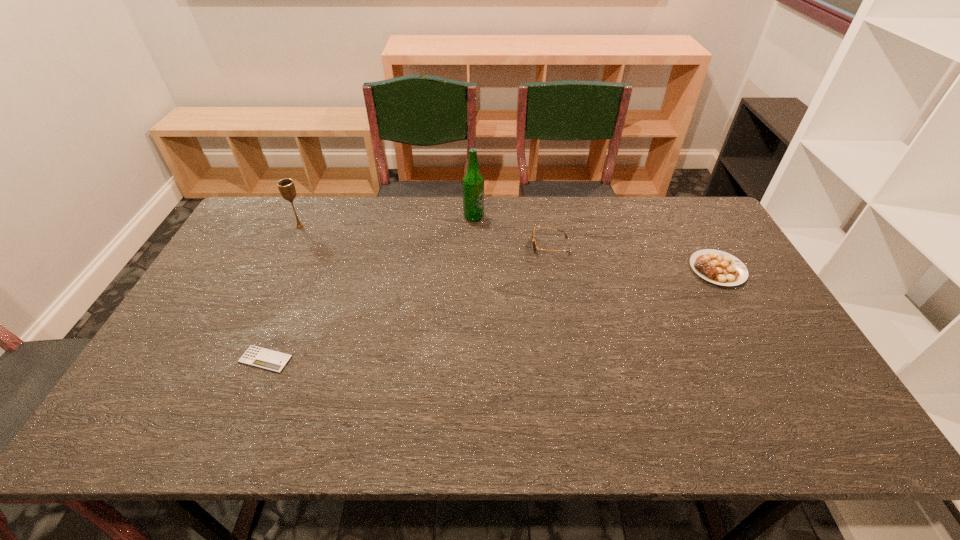
The width and height of the screenshot is (960, 540). Find the location of `blank area located 0.260m on the front of the chalice`. blank area located 0.260m on the front of the chalice is located at coordinates (272, 286).

Where is `free region located 0.100m on the front-facing side of the sunglasses`? free region located 0.100m on the front-facing side of the sunglasses is located at coordinates (501, 246).

You are a GUI agent. You are given a task and a screenshot of the screen. Output one action in this format:
    pyautogui.click(x=<x>, y=<y>)
    Task: Click on the vacant space located 0.190m on the front-facing side of the sunglasses
    The image size is (960, 540).
    Given the screenshot: What is the action you would take?
    pyautogui.click(x=472, y=246)

You are a GUI agent. You are given a task and a screenshot of the screen. Output one action in this format:
    pyautogui.click(x=<x>, y=<y>)
    Task: Click on the vacant space located on the front-facing side of the sunglasses
    This screenshot has height=540, width=960.
    Given the screenshot: What is the action you would take?
    pyautogui.click(x=516, y=246)

Image resolution: width=960 pixels, height=540 pixels. In order to click on vacant space situated on the front of the second shortest object in this screenshot , I will do (740, 309).

Where is `free space located on the front of the nearest object`? This screenshot has width=960, height=540. free space located on the front of the nearest object is located at coordinates (247, 403).

The height and width of the screenshot is (540, 960). Find the location of `beer bottle present at the far edge`. beer bottle present at the far edge is located at coordinates (473, 182).

This screenshot has height=540, width=960. I want to click on chalice situated at the far edge, so click(x=286, y=186).

Locate an element on the screen. The height and width of the screenshot is (540, 960). sunglasses present at the far edge is located at coordinates (533, 239).

You are a GUI agent. You are given a task and a screenshot of the screen. Output one action in this format:
    pyautogui.click(x=<x>, y=<y>)
    Task: Click on the object that is at the right edge
    The image size is (960, 540).
    Given the screenshot: What is the action you would take?
    pyautogui.click(x=718, y=267)